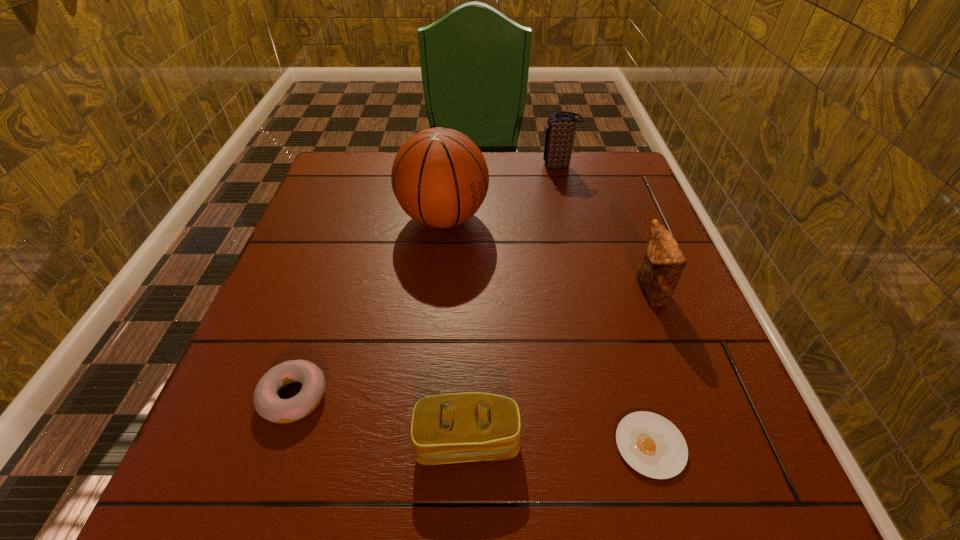
In the image, there is a desktop. In order to click on free space at the right edge in this screenshot , I will do `click(694, 397)`.

At what (x,y) coordinates should I click in order to perform the action: click on vacant area at the far left corner. Please return your answer as a coordinate pair (x, y). The width and height of the screenshot is (960, 540). Looking at the image, I should click on (349, 178).

In the image, there is a desktop. Where is `vacant space at the near left corner`? The image size is (960, 540). vacant space at the near left corner is located at coordinates (188, 510).

Where is `unoccupied position between the second shortest object and the fourth nearest object`? The image size is (960, 540). unoccupied position between the second shortest object and the fourth nearest object is located at coordinates (472, 344).

Locate an element on the screen. The width and height of the screenshot is (960, 540). blank region between the leftmost object and the farthest object is located at coordinates (426, 281).

At what (x,y) coordinates should I click in order to perform the action: click on empty space that is in between the fifth tallest object and the tallest object. Please return your answer as a coordinate pair (x, y). The image size is (960, 540). Looking at the image, I should click on (369, 307).

Where is `free space between the fourth nearest object and the shortest clutch bag`? The width and height of the screenshot is (960, 540). free space between the fourth nearest object and the shortest clutch bag is located at coordinates (559, 366).

I want to click on vacant area that lies between the leftmost clutch bag and the second nearest clutch bag, so click(559, 366).

At what (x,y) coordinates should I click in order to perform the action: click on blank region between the basketball and the doughnut. Please return your answer as a coordinate pair (x, y). Looking at the image, I should click on (369, 307).

Locate an element on the screen. This screenshot has height=540, width=960. vacant space that is in between the shortest object and the farthest object is located at coordinates (604, 306).